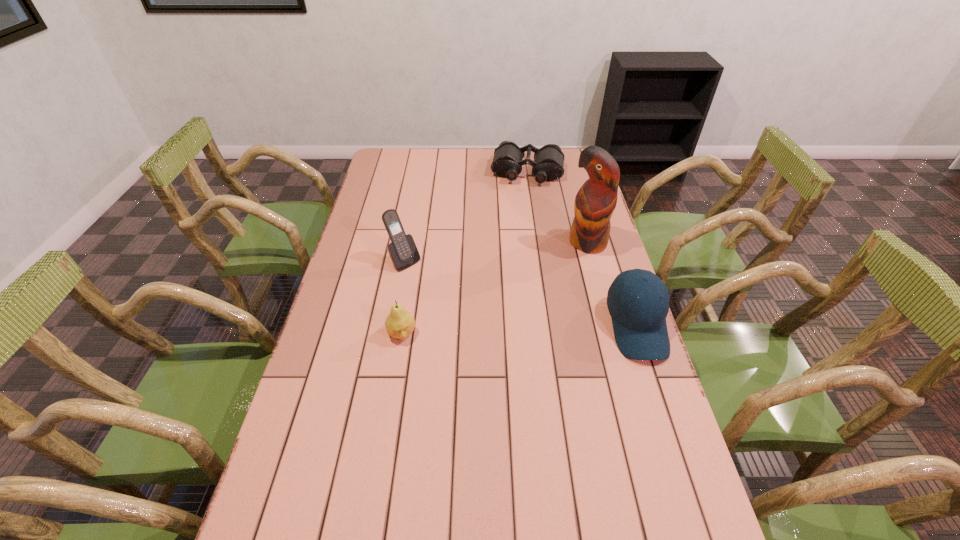
Find the location of a particular element. The image size is (960, 540). pear is located at coordinates (399, 324).

Identify the location of baseball cap. The height and width of the screenshot is (540, 960). (639, 324).

Identify the location of cellular telephone. click(402, 250).

The image size is (960, 540). What are the coordinates of `parrot` in the screenshot? It's located at (595, 202).

The width and height of the screenshot is (960, 540). Identify the location of binoculars. (548, 165).

The width and height of the screenshot is (960, 540). In order to click on the farthest object in this screenshot , I will do `click(548, 165)`.

Identify the location of free spot located 0.050m on the front of the pear. (397, 361).

Locate an element on the screen. The width and height of the screenshot is (960, 540). vacant space positioned on the front-facing side of the baseball cap is located at coordinates (682, 463).

At what (x,y) coordinates should I click in order to perform the action: click on vacant space located on the front-facing side of the second tallest object. Please return your answer as a coordinate pair (x, y). This screenshot has height=540, width=960. Looking at the image, I should click on (x=435, y=287).

The image size is (960, 540). I want to click on vacant region located on the front-facing side of the second tallest object, so click(450, 301).